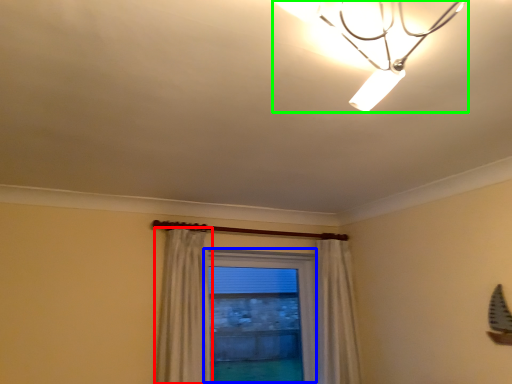
Question: Which is farther away from curtain (highlighted by a red box)? window (highlighted by a blue box) or lamp (highlighted by a green box)?

Choices:
 (A) window
 (B) lamp

Answer: (A)